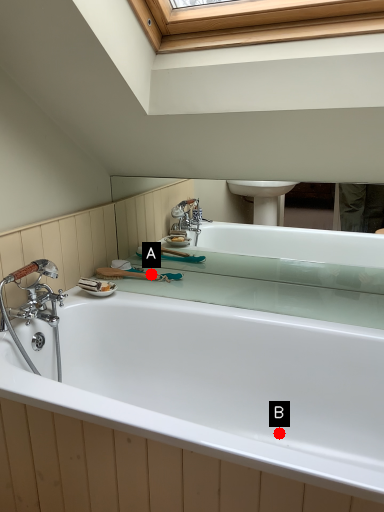
Question: Two points are circled on the image, labeled by A and B beside each circle. Which of the following is the closest to the observer?

Choices:
 (A) A is closer
 (B) B is closer

Answer: (B)